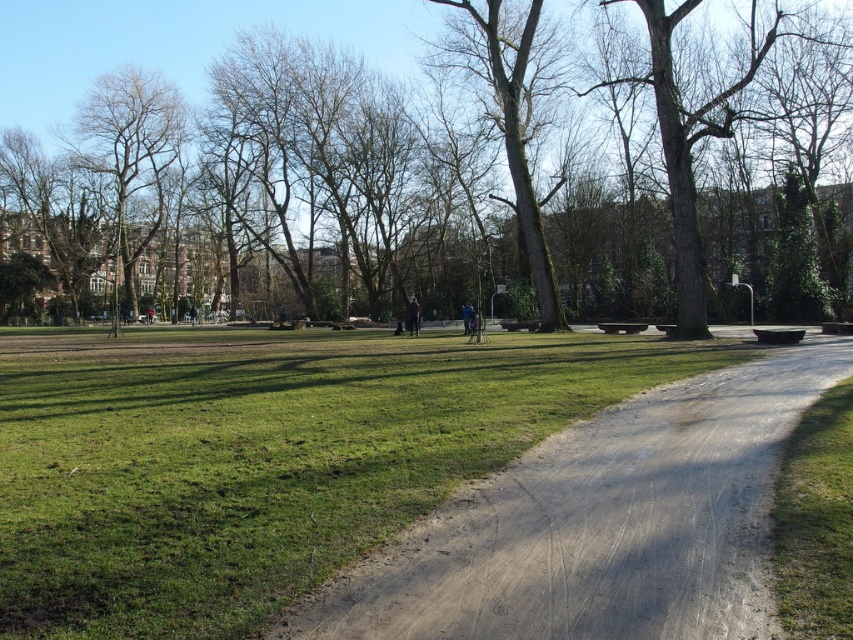
Question: Based on their relative distances, which object is nearer to the bare branches at upper left?

Choices:
 (A) dirt path at center
 (B) green mossy bark tree at center
 (C) brown textured tree at center

Answer: (C)

Question: Which point is farther from the camera taking this photo?

Choices:
 (A) (532, 262)
 (B) (132, 104)
 (C) (488, 496)
 (D) (387, 52)

Answer: (D)

Question: Can you confirm if brown textured tree at center is positioned to the right of bare branches at upper left?

Choices:
 (A) no
 (B) yes

Answer: (B)

Question: Which point is closer to the camera?

Choices:
 (A) brown textured tree at center
 (B) bare branches at upper left
 (C) green mossy bark tree at center

Answer: (C)

Question: Is bare branches at upper left thinner than green mossy bark tree at center?

Choices:
 (A) no
 (B) yes

Answer: (A)

Question: Can you confirm if brown textured tree at center is positioned below green mossy bark tree at center?

Choices:
 (A) yes
 (B) no

Answer: (B)